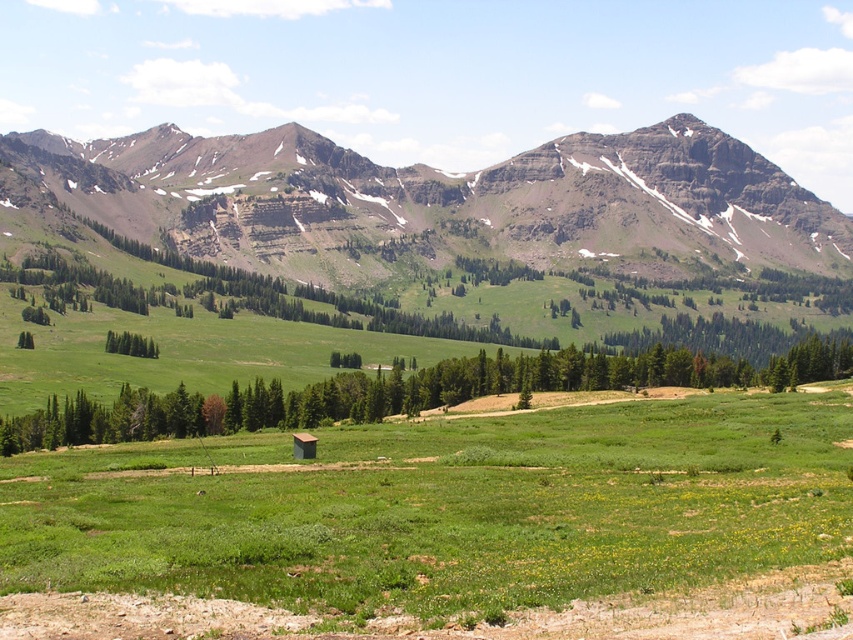
Question: Which point is farther from the camera taking this photo?

Choices:
 (A) (625, 202)
 (B) (137, 438)

Answer: (A)

Question: Can you confirm if rocky brown mountain range at upper center is positioned above green leafy tree at center?

Choices:
 (A) yes
 (B) no

Answer: (A)

Question: Is rocky brown mountain range at upper center thinner than green leafy tree at center?

Choices:
 (A) no
 (B) yes

Answer: (A)

Question: Which of the following is the farthest from the observer?

Choices:
 (A) green leafy tree at center
 (B) rocky brown mountain range at upper center

Answer: (B)

Question: Can you confirm if rocky brown mountain range at upper center is bigger than green leafy tree at center?

Choices:
 (A) no
 (B) yes

Answer: (B)

Question: Which point is farther to the camera?

Choices:
 (A) rocky brown mountain range at upper center
 (B) green leafy tree at center

Answer: (A)